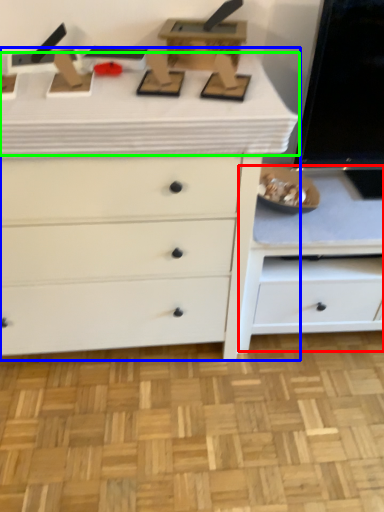
Question: Considering the real-world distances, which object is closest to cabinetry (highlighted by a red box)? chest of drawers (highlighted by a blue box) or counter top (highlighted by a green box).

Choices:
 (A) chest of drawers
 (B) counter top

Answer: (A)